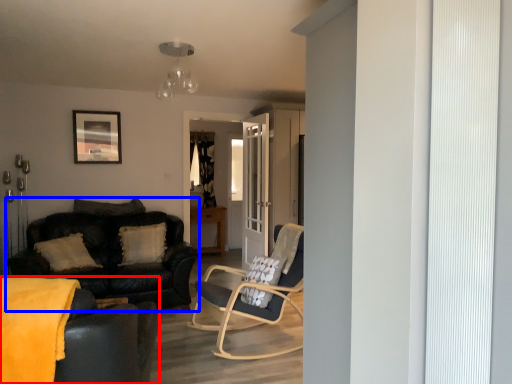
Question: Which object is further to the camera taking this photo, studio couch (highlighted by a red box) or studio couch (highlighted by a blue box)?

Choices:
 (A) studio couch
 (B) studio couch

Answer: (B)